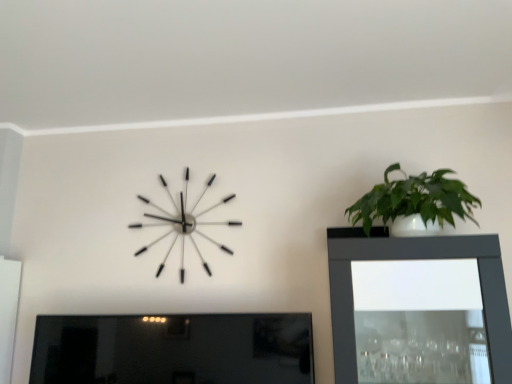
Question: From the image's perspective, would you say matte black picture frame at lower left is shown under green glossy plant at upper right?

Choices:
 (A) no
 (B) yes

Answer: (B)

Question: Considering the relative positions of matte black picture frame at lower left and green glossy plant at upper right in the image provided, is matte black picture frame at lower left behind green glossy plant at upper right?

Choices:
 (A) no
 (B) yes

Answer: (B)

Question: Is matte black picture frame at lower left bigger than green glossy plant at upper right?

Choices:
 (A) yes
 (B) no

Answer: (A)

Question: Would you say green glossy plant at upper right is part of matte black picture frame at lower left's contents?

Choices:
 (A) yes
 (B) no

Answer: (B)

Question: From the image's perspective, does matte black picture frame at lower left appear higher than green glossy plant at upper right?

Choices:
 (A) yes
 (B) no

Answer: (B)

Question: Is matte black picture frame at lower left closer to camera compared to green glossy plant at upper right?

Choices:
 (A) yes
 (B) no

Answer: (B)

Question: From the image's perspective, would you say green glossy plant at upper right is positioned over metallic silver clock at upper left?

Choices:
 (A) yes
 (B) no

Answer: (A)

Question: Considering the relative positions of green glossy plant at upper right and metallic silver clock at upper left in the image provided, is green glossy plant at upper right behind metallic silver clock at upper left?

Choices:
 (A) no
 (B) yes

Answer: (A)

Question: Is green glossy plant at upper right at the left side of metallic silver clock at upper left?

Choices:
 (A) yes
 (B) no

Answer: (B)

Question: Is the surface of green glossy plant at upper right in direct contact with metallic silver clock at upper left?

Choices:
 (A) yes
 (B) no

Answer: (B)

Question: Does green glossy plant at upper right appear on the right side of metallic silver clock at upper left?

Choices:
 (A) yes
 (B) no

Answer: (A)

Question: Is green glossy plant at upper right thinner than metallic silver clock at upper left?

Choices:
 (A) no
 (B) yes

Answer: (A)

Question: Is matte black picture frame at lower left taller than metallic silver clock at upper left?

Choices:
 (A) yes
 (B) no

Answer: (B)